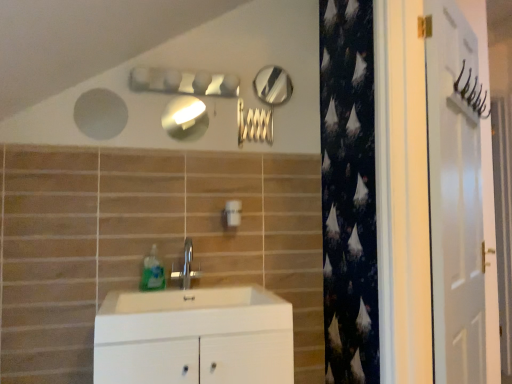
In order to face silver metallic faucet at center, should I rotate leftwards or rightwards?

Rotate your view left by about 9.338°.

How much space does matte silver mirror at upper center, which is the first mirror from bottom to top, occupy horizontally?

matte silver mirror at upper center, which is the first mirror from bottom to top, is 0.91 inches wide.

Describe the element at coordinates (233, 213) in the screenshot. I see `white plastic light switch at center` at that location.

This screenshot has height=384, width=512. I want to click on white plastic light switch at center, so click(233, 213).

Where is `white glossy door at right`? The height and width of the screenshot is (384, 512). white glossy door at right is located at coordinates (459, 203).

From the image's perspective, does matte silver mirror at upper center, positioned as the 1th mirror in front-to-back order, appear higher than translucent plastic soap dispenser at sink?

Yes.

From a real-world perspective, is matte silver mirror at upper center, which is the first mirror from bottom to top, physically above translucent plastic soap dispenser at sink?

Indeed, from a real-world perspective, matte silver mirror at upper center, which is the first mirror from bottom to top, stands above translucent plastic soap dispenser at sink.

Is matte silver mirror at upper center, which is the 1th mirror in left-to-right order, situated inside translucent plastic soap dispenser at sink or outside?

The correct answer is: outside.

Could you tell me if matte silver mirror at upper center, positioned as the 1th mirror in front-to-back order, is facing translucent plastic soap dispenser at sink?

No, matte silver mirror at upper center, positioned as the 1th mirror in front-to-back order, is not turned towards translucent plastic soap dispenser at sink.

Is there a large distance between white matte cabinet at center and polished silver mirror at upper center, positioned as the 2th mirror in left-to-right order?

Yes, white matte cabinet at center and polished silver mirror at upper center, positioned as the 2th mirror in left-to-right order, are quite far apart.

Can polished silver mirror at upper center, the first mirror in the back-to-front sequence, be found inside white matte cabinet at center?

No, polished silver mirror at upper center, the first mirror in the back-to-front sequence, is located outside of white matte cabinet at center.

Locate an element on the screen. the 2nd mirror above the white matte cabinet at center (from the image's perspective) is located at coordinates (273, 85).

Which of these two, white matte cabinet at center or polished silver mirror at upper center, positioned as the 2th mirror in left-to-right order, is wider?

Wider between the two is white matte cabinet at center.

From their relative heights in the image, would you say white plastic light switch at center is taller or shorter than polished silver mirror at upper center, the 2th mirror viewed from the front?

Considering their sizes, white plastic light switch at center has less height than polished silver mirror at upper center, the 2th mirror viewed from the front.

In terms of size, does white plastic light switch at center appear bigger or smaller than polished silver mirror at upper center, which ranks as the 2th mirror in bottom-to-top order?

Clearly, white plastic light switch at center is larger in size than polished silver mirror at upper center, which ranks as the 2th mirror in bottom-to-top order.

Are white plastic light switch at center and polished silver mirror at upper center, which ranks as the 2th mirror in bottom-to-top order, far apart?

That's not correct — white plastic light switch at center is a little close to polished silver mirror at upper center, which ranks as the 2th mirror in bottom-to-top order.

Find the location of a particular element. light switch above the silver metallic faucet at center (from a real-world perspective) is located at coordinates (233, 213).

What's the angular difference between silver metallic faucet at center and white plastic light switch at center's facing directions?

silver metallic faucet at center and white plastic light switch at center are facing 5.24 degrees away from each other.

Is white plastic light switch at center a part of silver metallic faucet at center?

That's incorrect, white plastic light switch at center is not inside silver metallic faucet at center.

Which is further, (x=180, y=275) or (x=238, y=215)?

Positioned behind is point (x=238, y=215).

From the image's perspective, is white glossy door at right beneath white plastic light switch at center?

No, from the image's perspective, white glossy door at right is not below white plastic light switch at center.

Between point (476, 380) and point (226, 208), which one is positioned behind?

The point (476, 380) is farther from the camera.

Looking at this image, is white glossy door at right turned away from white plastic light switch at center?

That's right, white glossy door at right is facing away from white plastic light switch at center.

Is white plastic light switch at center a part of white glossy door at right?

No, white glossy door at right does not contain white plastic light switch at center.

From a real-world perspective, which object stands above the other?

white glossy door at right, from a real-world perspective.

From the image's perspective, which is below, silver metallic faucet at center or white glossy door at right?

From the image's view, silver metallic faucet at center is below.

Can you see silver metallic faucet at center touching white glossy door at right?

→ silver metallic faucet at center and white glossy door at right are clearly separated.

Is white plastic light switch at center positioned with its back to matte silver mirror at upper center, positioned as the 1th mirror in front-to-back order?

No, white plastic light switch at center is not facing away from matte silver mirror at upper center, positioned as the 1th mirror in front-to-back order.

Looking at this image, is white plastic light switch at center to the left or to the right of matte silver mirror at upper center, the second mirror when ordered from top to bottom, in the image?

Clearly, white plastic light switch at center is on the right of matte silver mirror at upper center, the second mirror when ordered from top to bottom, in the image.

Considering the sizes of objects white plastic light switch at center and matte silver mirror at upper center, the second mirror when ordered from top to bottom, in the image provided, who is bigger, white plastic light switch at center or matte silver mirror at upper center, the second mirror when ordered from top to bottom,?

white plastic light switch at center.

Between point (232, 222) and point (189, 124), which one is positioned behind?

The point (189, 124) is farther from the camera.

Image resolution: width=512 pixels, height=384 pixels. I want to click on soap dispenser on the left of matte silver mirror at upper center, which is the first mirror from bottom to top, so click(152, 272).

In order to click on the 2nd mirror above the white matte cabinet at center (from the image's perspective) in this screenshot , I will do `click(273, 85)`.

Looking at the image, which one is located further to white plastic light switch at center, white matte cabinet at center or white glossy door at right?

Based on the image, white glossy door at right appears to be further to white plastic light switch at center.

Looking at the image, which one is located closer to silver metallic faucet at center, polished silver mirror at upper center, the 1th mirror positioned from the right, or white matte cabinet at center?

white matte cabinet at center lies closer to silver metallic faucet at center than the other object.

Consider the image. Which object lies nearer to the anchor point white matte cabinet at center, polished silver mirror at upper center, acting as the first mirror starting from the top, or translucent plastic soap dispenser at sink?

The object closer to white matte cabinet at center is translucent plastic soap dispenser at sink.

From the image, which object appears to be farther from matte silver mirror at upper center, which is the 1th mirror in left-to-right order, white plastic light switch at center or translucent plastic soap dispenser at sink?

translucent plastic soap dispenser at sink lies further to matte silver mirror at upper center, which is the 1th mirror in left-to-right order, than the other object.

Looking at the image, which one is located further to silver metallic faucet at center, matte silver mirror at upper center, the 2th mirror from the back, or polished silver mirror at upper center, the 1th mirror positioned from the right?

Among the two, polished silver mirror at upper center, the 1th mirror positioned from the right, is located further to silver metallic faucet at center.

Considering their positions, is translucent plastic soap dispenser at sink positioned closer to polished silver mirror at upper center, positioned as the 2th mirror in left-to-right order, than silver metallic faucet at center?

silver metallic faucet at center is positioned closer to the anchor polished silver mirror at upper center, positioned as the 2th mirror in left-to-right order.

Looking at the image, which one is located further to polished silver mirror at upper center, the 2th mirror viewed from the front, white glossy door at right or matte silver mirror at upper center, the 2th mirror from the back?

Based on the image, white glossy door at right appears to be further to polished silver mirror at upper center, the 2th mirror viewed from the front.

From the image, which object appears to be farther from white glossy door at right, white matte cabinet at center or silver metallic faucet at center?

Among the two, silver metallic faucet at center is located further to white glossy door at right.

Locate an element on the screen. tap between translucent plastic soap dispenser at sink and white glossy door at right from left to right is located at coordinates (186, 267).

Find the location of a particular element. This screenshot has height=384, width=512. bathroom cabinet located between silver metallic faucet at center and white glossy door at right in the left-right direction is located at coordinates (194, 337).

In order to click on light switch between matte silver mirror at upper center, which is the 1th mirror in left-to-right order, and silver metallic faucet at center in the up-down direction in this screenshot , I will do `click(233, 213)`.

Locate an element on the screen. The height and width of the screenshot is (384, 512). light switch between polished silver mirror at upper center, which ranks as the 2th mirror in bottom-to-top order, and translucent plastic soap dispenser at sink in the up-down direction is located at coordinates point(233,213).